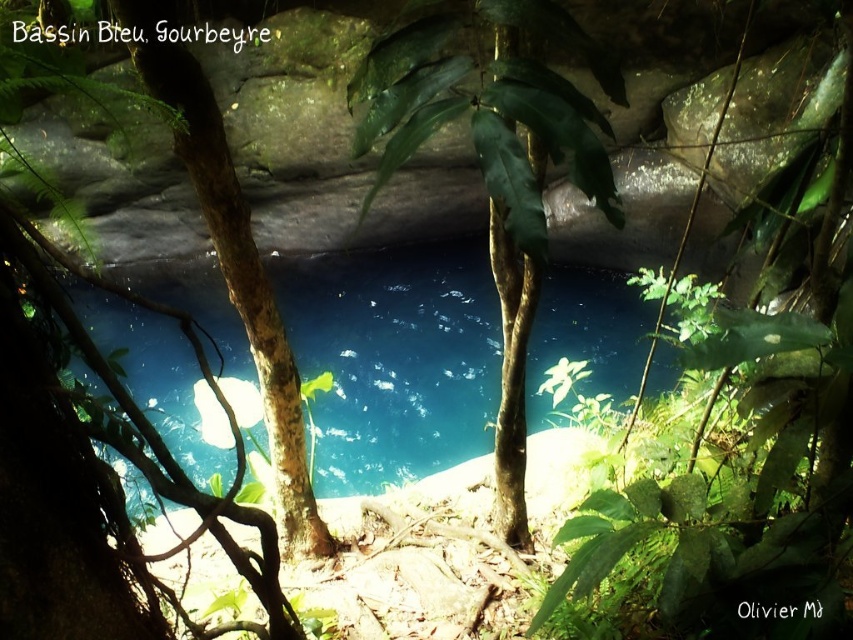
You are a hiker carrying a 2.5 meter long wooden pole. You want to place the pole horizontally between the transparent blue water at center and the brown rough tree trunk at center. Will the pole fit between them?

The distance between the transparent blue water at center and the brown rough tree trunk at center is 3.42 meters, so the 2.5 meter long pole will fit between them since it is shorter than the distance.

From the picture: You are standing at the edge of the pool at Bassin Bleu, Gourbeyre. You want to locate the transparent blue water at center. According to the coordinates provided, where exactly is it located?

The transparent blue water at center is located at point [397,362].

You are standing in front of the Bassin Bleu, Gourbeyre scene and want to take a photo of the transparent blue water at center and the green rough bark tree at center. Which object is closer to you?

The transparent blue water at center is closer to you than the green rough bark tree at center.